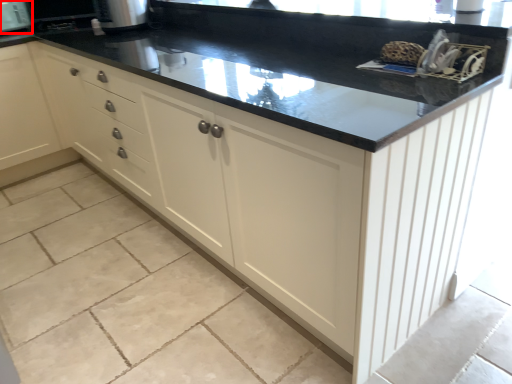
Question: From the image's perspective, considering the relative positions of appliance (annotated by the red box) and appliance in the image provided, where is appliance (annotated by the red box) located with respect to the staircase?

Choices:
 (A) above
 (B) below

Answer: (A)